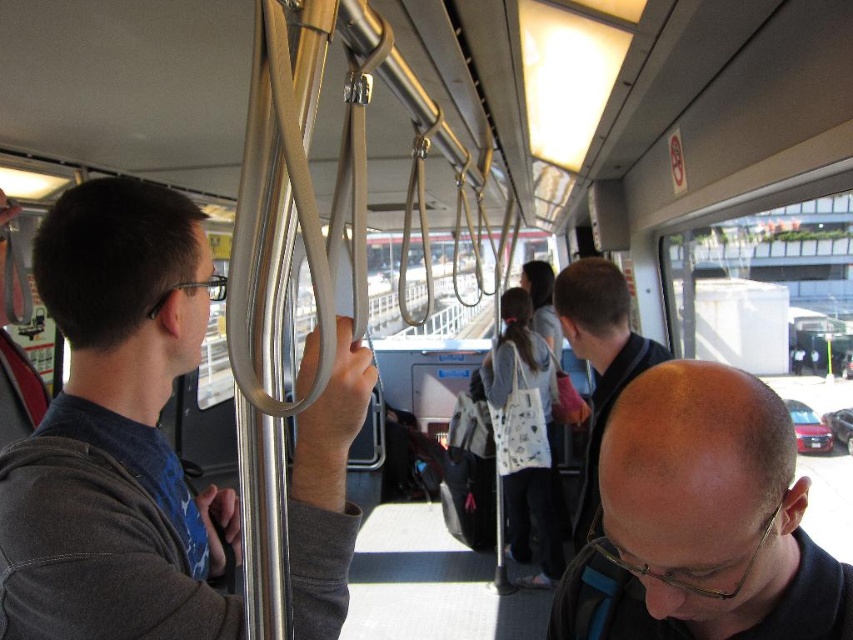
Does point (648, 524) come behind point (503, 355)?

No, (648, 524) is closer to viewer.

Does bald head at lower right have a smaller size compared to white fabric bag at center?

Indeed, bald head at lower right has a smaller size compared to white fabric bag at center.

Image resolution: width=853 pixels, height=640 pixels. What are the coordinates of `bald head at lower right` in the screenshot? It's located at (701, 520).

Between matte gray pole at left and dark blue hoodie at center, which one appears on the left side from the viewer's perspective?

matte gray pole at left is more to the left.

Does matte gray pole at left have a lesser width compared to dark blue hoodie at center?

Incorrect, matte gray pole at left's width is not less than dark blue hoodie at center's.

Does point (346, 442) lie in front of point (608, 324)?

Yes, it is in front of point (608, 324).

Locate an element on the screen. This screenshot has height=640, width=853. matte gray pole at left is located at coordinates (115, 433).

Identify the location of white fabric bag at center. The height and width of the screenshot is (640, 853). (525, 435).

Is white fabric bag at center thinner than dark blue hoodie at center?

No.

Does point (532, 513) lie in front of point (613, 300)?

No, it is behind (613, 300).

Locate an element on the screen. white fabric bag at center is located at coordinates (525, 435).